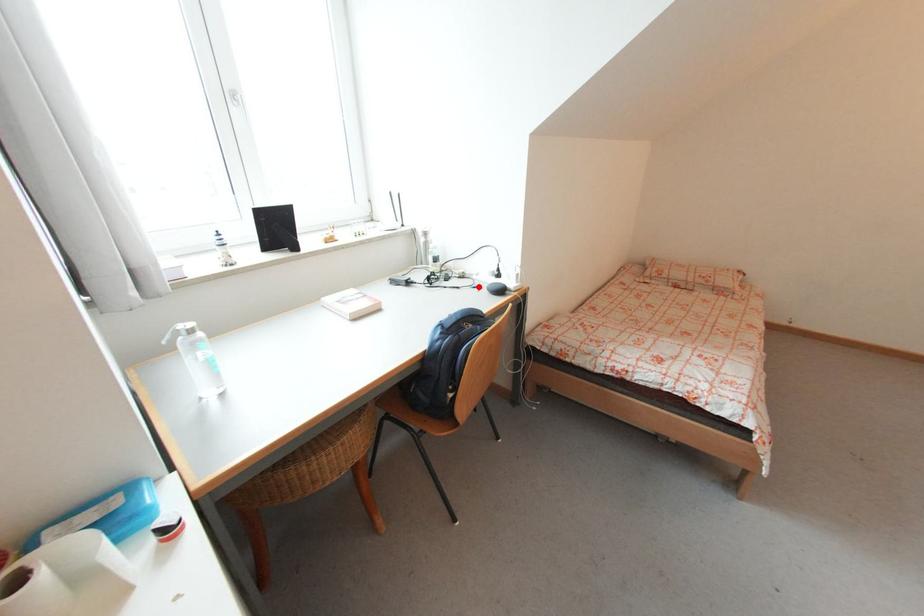
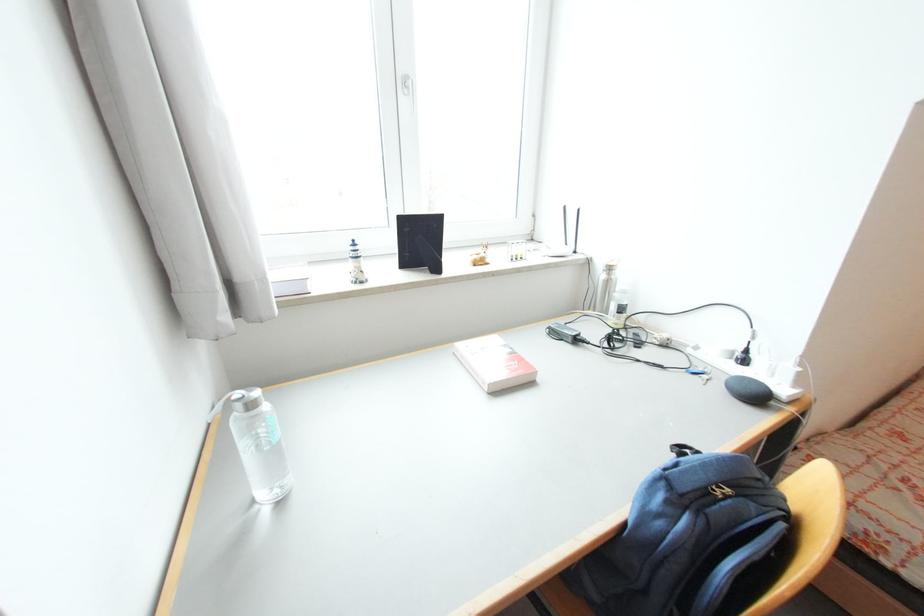
In the second image, find the point that corresponds to the highlighted location in the first image.

(697, 370)